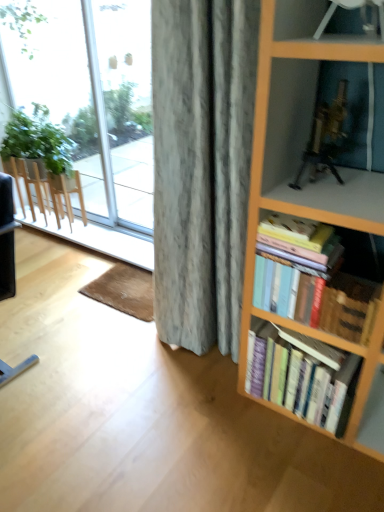
Question: Considering the relative sizes of hardcover books at right, the 1th book when ordered from bottom to top, and transparent glass door at left in the image provided, is hardcover books at right, the 1th book when ordered from bottom to top, shorter than transparent glass door at left?

Choices:
 (A) yes
 (B) no

Answer: (A)

Question: Considering the relative positions of hardcover books at right, acting as the 2th book starting from the top, and transparent glass door at left in the image provided, is hardcover books at right, acting as the 2th book starting from the top, to the left of transparent glass door at left from the viewer's perspective?

Choices:
 (A) yes
 (B) no

Answer: (B)

Question: Is hardcover books at right, acting as the 2th book starting from the top, wider than transparent glass door at left?

Choices:
 (A) no
 (B) yes

Answer: (B)

Question: Is there a large distance between hardcover books at right, the 1th book when ordered from bottom to top, and transparent glass door at left?

Choices:
 (A) yes
 (B) no

Answer: (A)

Question: Can you confirm if hardcover books at right, the 1th book when ordered from bottom to top, is taller than transparent glass door at left?

Choices:
 (A) no
 (B) yes

Answer: (A)

Question: From the image's perspective, is hardcover books at right, the 1th book when ordered from bottom to top, above or below transparent glass window at upper left?

Choices:
 (A) above
 (B) below

Answer: (B)

Question: Is hardcover books at right, acting as the 2th book starting from the top, in front of or behind transparent glass window at upper left in the image?

Choices:
 (A) front
 (B) behind

Answer: (A)

Question: From a real-world perspective, is hardcover books at right, the 1th book when ordered from bottom to top, positioned above or below transparent glass window at upper left?

Choices:
 (A) below
 (B) above

Answer: (A)

Question: Considering the positions of hardcover books at right, the 1th book when ordered from bottom to top, and transparent glass window at upper left in the image, is hardcover books at right, the 1th book when ordered from bottom to top, taller or shorter than transparent glass window at upper left?

Choices:
 (A) short
 (B) tall

Answer: (A)

Question: From the image's perspective, relative to transparent glass door at left, is black leather chair at lower left above or below?

Choices:
 (A) above
 (B) below

Answer: (B)

Question: Is black leather chair at lower left to the left or to the right of transparent glass door at left in the image?

Choices:
 (A) left
 (B) right

Answer: (A)

Question: In terms of size, does black leather chair at lower left appear bigger or smaller than transparent glass door at left?

Choices:
 (A) small
 (B) big

Answer: (B)

Question: Is black leather chair at lower left situated inside transparent glass door at left or outside?

Choices:
 (A) outside
 (B) inside

Answer: (A)

Question: In the image, is transparent glass window at upper left positioned in front of or behind metallic gold tripod at upper right?

Choices:
 (A) behind
 (B) front

Answer: (A)

Question: Is transparent glass window at upper left inside or outside of metallic gold tripod at upper right?

Choices:
 (A) inside
 (B) outside

Answer: (B)